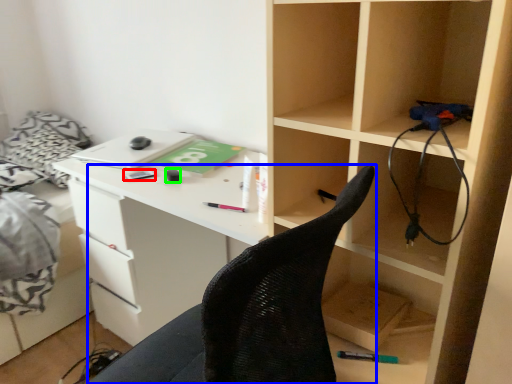
Question: Estimate the real-world distances between objects in this image. Which object is farther from stationery (highlighted by a red box), chair (highlighted by a blue box) or stationery (highlighted by a green box)?

Choices:
 (A) chair
 (B) stationery

Answer: (A)